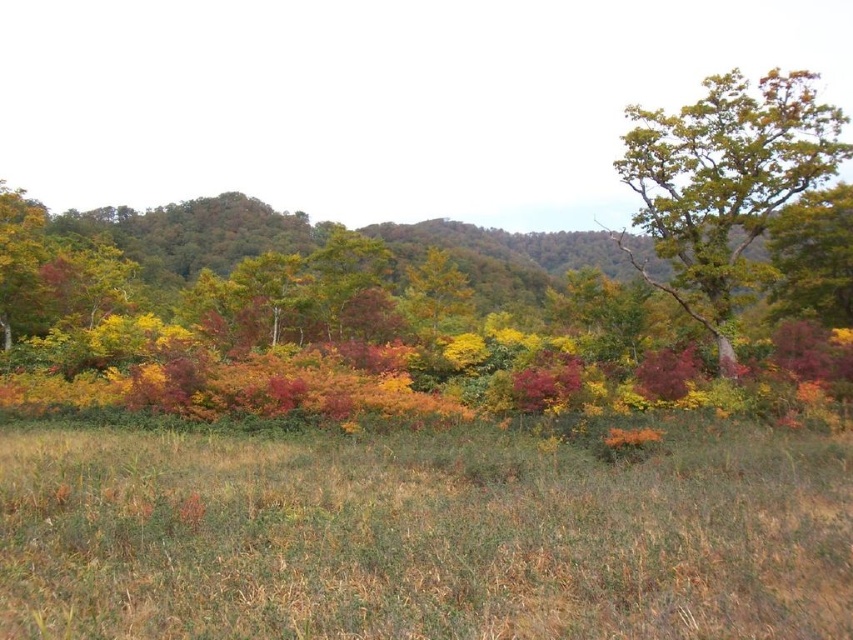
Is point (28, 449) positioned after point (689, 292)?

No, it is in front of (689, 292).

Is point (677, 490) farther from camera compared to point (780, 186)?

No.

Where is `brown dry grass at center`? The image size is (853, 640). brown dry grass at center is located at coordinates (421, 538).